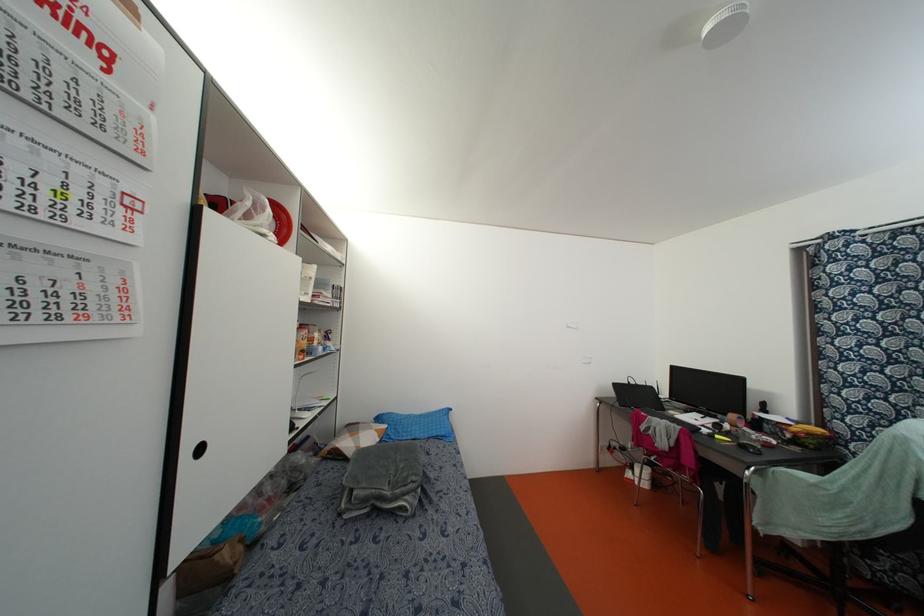
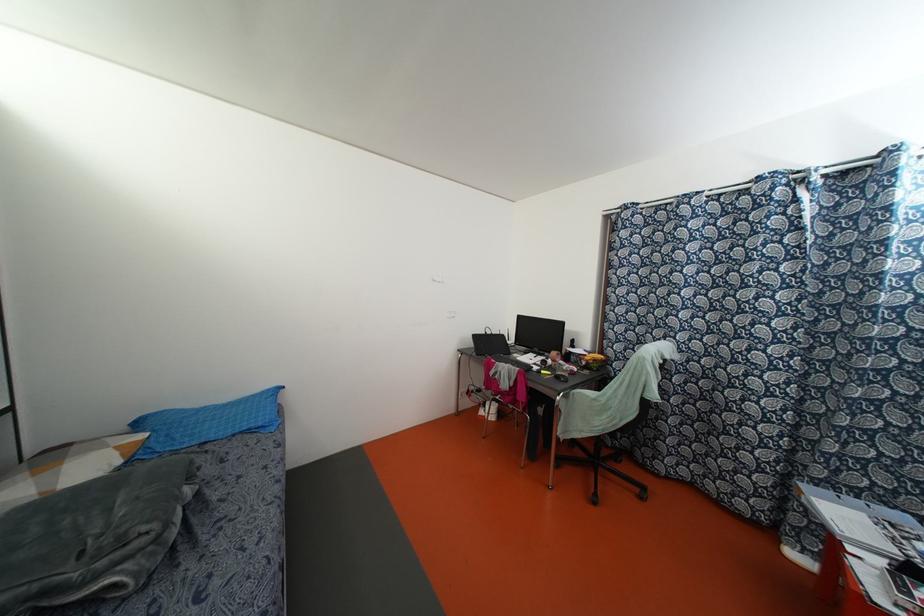
The point at (x=758, y=477) is marked in the first image. Where is the corresponding point in the second image?

(564, 399)